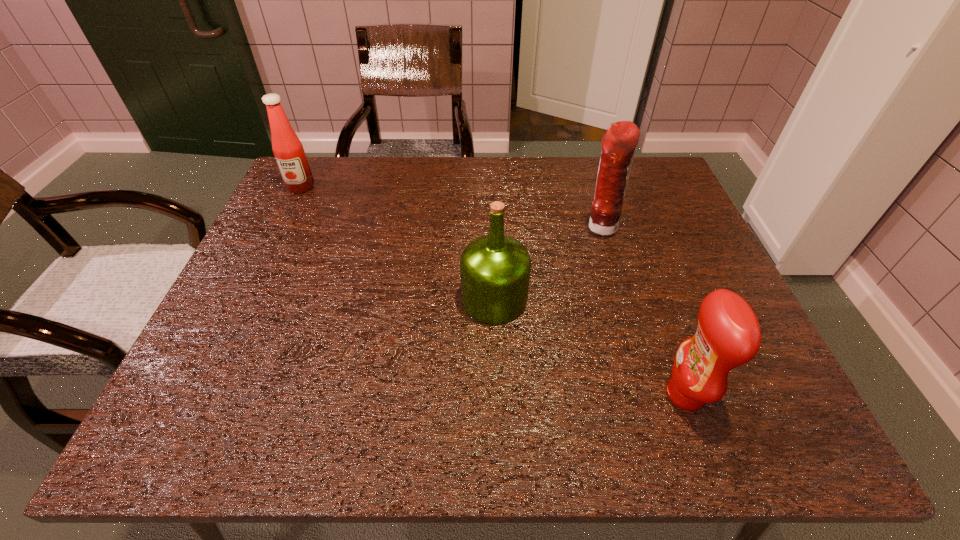
This screenshot has height=540, width=960. In the image, there is a desktop. What are the coordinates of `free space at the left edge` in the screenshot? It's located at (262, 232).

Find the location of a particular element. vacant space at the right edge is located at coordinates (664, 281).

This screenshot has height=540, width=960. In order to click on free spot at the near left corner of the desktop in this screenshot , I will do `click(221, 416)`.

Identify the location of free spot at the far right corner of the desktop. The image size is (960, 540). (675, 187).

Identify the location of vacant area at the near right corner. (749, 437).

Find the location of a particular element. This screenshot has height=540, width=960. free area in between the leftmost object and the second nearest object is located at coordinates (397, 243).

Where is `vacant area that lies between the nearest condiment and the second nearest condiment`? The width and height of the screenshot is (960, 540). vacant area that lies between the nearest condiment and the second nearest condiment is located at coordinates (642, 310).

You are a GUI agent. You are given a task and a screenshot of the screen. Output one action in this format:
    pyautogui.click(x=<x>, y=<y>)
    Task: Click on the empty space between the second object from left to right and the nearest condiment
    
    Given the screenshot: What is the action you would take?
    pyautogui.click(x=589, y=347)

Find the location of `vacant space that's between the second object from left to right and the second nearest condiment`. vacant space that's between the second object from left to right and the second nearest condiment is located at coordinates point(547,263).

Identify the location of vacant space in between the second object from left to right and the nearest condiment. (589, 347).